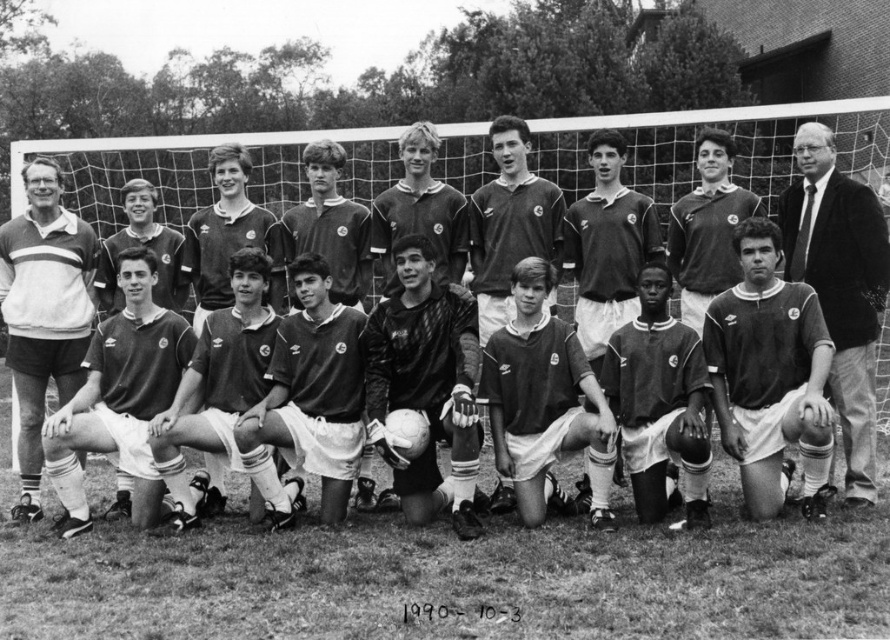
Is dark blue jersey at center further to the viewer compared to dark green jersey at center?

No.

Which is in front, point (409, 372) or point (86, 376)?

Positioned in front is point (409, 372).

This screenshot has height=640, width=890. Find the location of `dark blue jersey at center`. dark blue jersey at center is located at coordinates (425, 385).

The image size is (890, 640). Identify the location of dark brown jersey at center. (769, 374).

Does dark brown jersey at center have a lesser height compared to dark blue jersey at center?

Indeed, dark brown jersey at center has a lesser height compared to dark blue jersey at center.

Image resolution: width=890 pixels, height=640 pixels. Identify the location of dark brown jersey at center. (769, 374).

Find the location of a particular element. The height and width of the screenshot is (640, 890). dark brown jersey at center is located at coordinates (769, 374).

Does dark brown jersey at center have a lesser width compared to striped sweater at left?

Indeed, dark brown jersey at center has a lesser width compared to striped sweater at left.

Is point (729, 394) behind point (61, 300)?

No, (729, 394) is in front of (61, 300).

Does point (816, 483) lie behind point (53, 298)?

No, it is in front of (53, 298).

Locate an element on the screen. The image size is (890, 640). dark brown jersey at center is located at coordinates (769, 374).